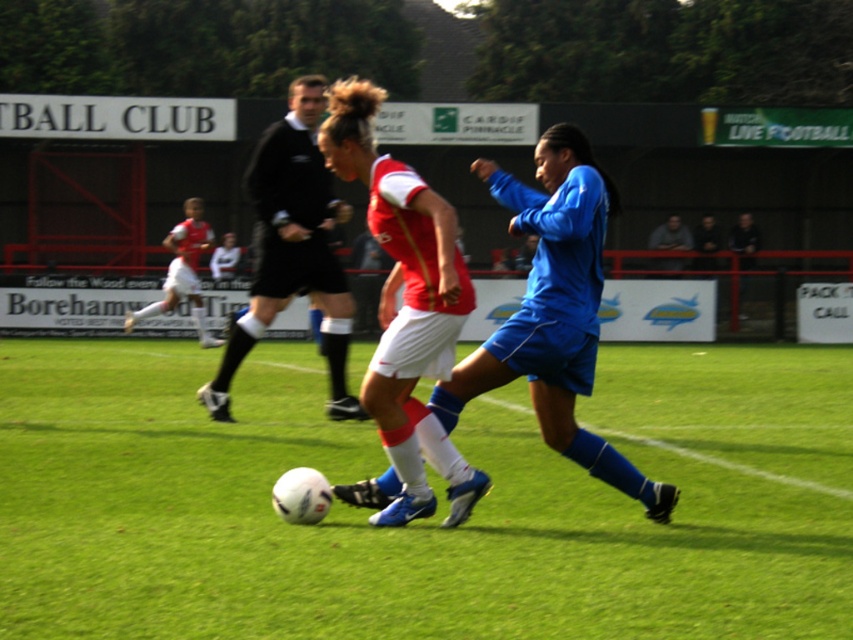
Question: Which point is closer to the camera?

Choices:
 (A) (277, 134)
 (B) (375, 204)
 (C) (659, 244)
 (D) (190, 269)

Answer: (B)

Question: Is blue fabric jersey at center smaller than gray fabric shirt at upper right?

Choices:
 (A) no
 (B) yes

Answer: (A)

Question: Does black jersey at center appear on the right side of gray fabric shirt at upper right?

Choices:
 (A) no
 (B) yes

Answer: (A)

Question: Which point is closer to the camera taking this photo?

Choices:
 (A) (397, 419)
 (B) (572, 525)
 (C) (207, 228)
 (D) (659, 257)

Answer: (A)

Question: Which point is closer to the camera?

Choices:
 (A) blue fabric jersey at center
 (B) matte red jersey at center
 (C) green grass football field at center
 (D) black jersey at center

Answer: (C)

Question: Is blue fabric jersey at center to the left of white jersey at center from the viewer's perspective?

Choices:
 (A) no
 (B) yes

Answer: (A)